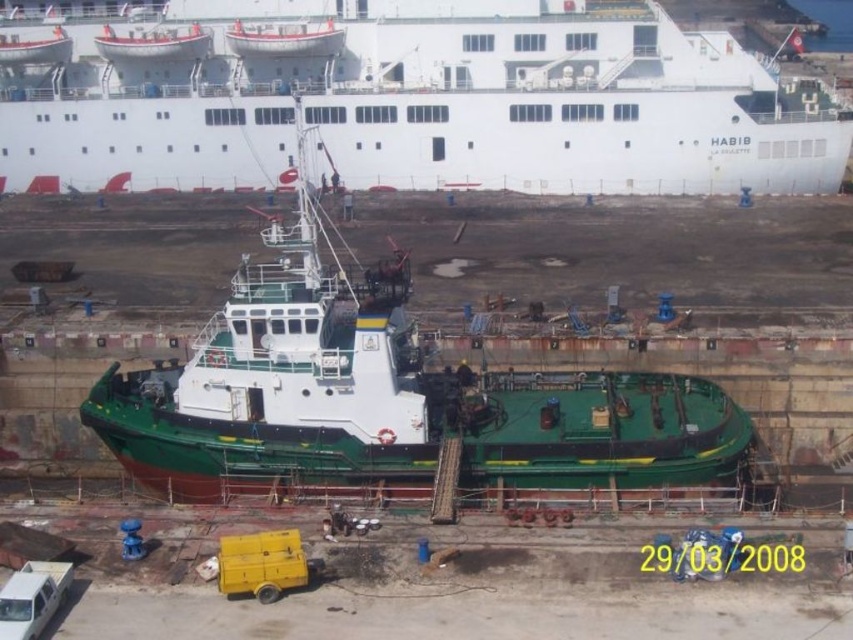
Between green matte tugboat at center and white glossy lifeboat at upper center, which one is positioned lower?

green matte tugboat at center

Is point (280, 484) less distant than point (241, 22)?

Yes, it is.

What do you see at coordinates (387, 397) in the screenshot? The height and width of the screenshot is (640, 853). I see `green matte tugboat at center` at bounding box center [387, 397].

Where is `green matte tugboat at center`? The height and width of the screenshot is (640, 853). green matte tugboat at center is located at coordinates (387, 397).

Is white glossy cruise ship at upper center to the left of green matte tugboat at center from the viewer's perspective?

No, white glossy cruise ship at upper center is not to the left of green matte tugboat at center.

Who is shorter, white glossy cruise ship at upper center or green matte tugboat at center?

white glossy cruise ship at upper center is shorter.

You are a GUI agent. You are given a task and a screenshot of the screen. Output one action in this format:
    pyautogui.click(x=<x>, y=<y>)
    Task: Click on the white glossy cruise ship at upper center
    This screenshot has width=853, height=640.
    Given the screenshot: What is the action you would take?
    pyautogui.click(x=407, y=97)

Image resolution: width=853 pixels, height=640 pixels. What are the coordinates of `white glossy cruise ship at upper center` in the screenshot? It's located at (407, 97).

Who is more forward, (706,157) or (294,42)?

Point (706,157) is more forward.

Where is `white glossy cruise ship at upper center`? The image size is (853, 640). white glossy cruise ship at upper center is located at coordinates (407, 97).

Locate an element on the screen. This screenshot has width=853, height=640. white glossy cruise ship at upper center is located at coordinates (407, 97).

What are the coordinates of `white glossy cruise ship at upper center` in the screenshot? It's located at click(407, 97).